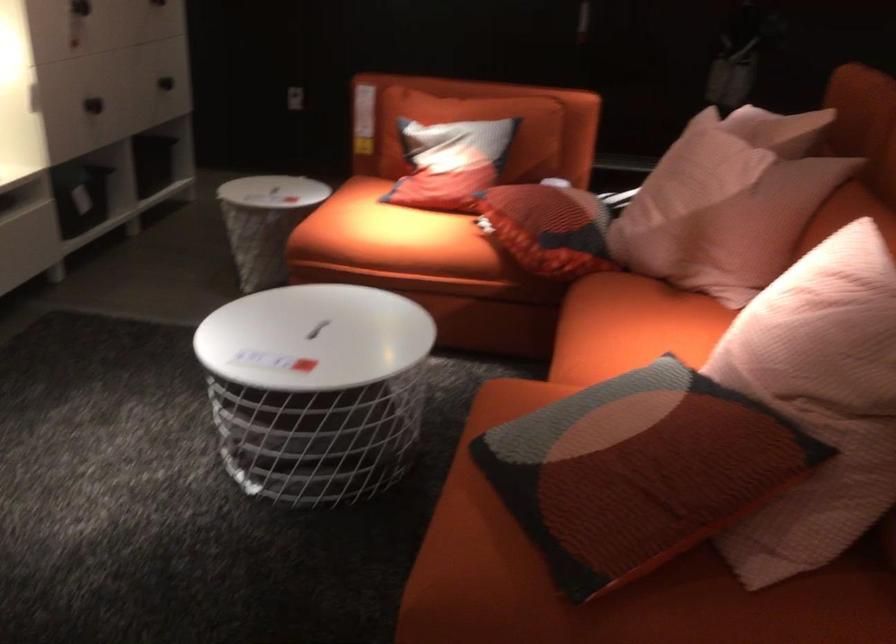
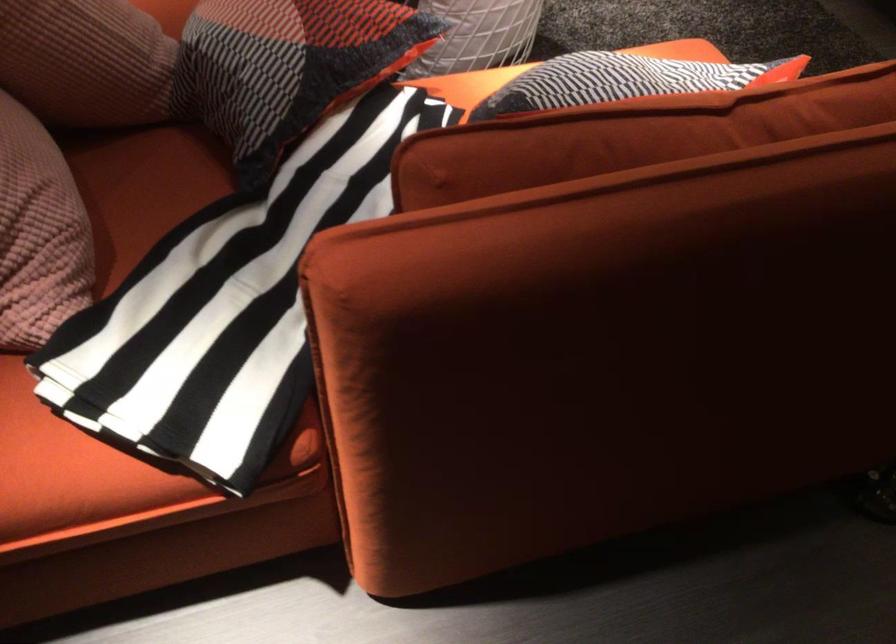
In the second image, find the point that corresponds to [470,118] in the first image.

(623, 80)